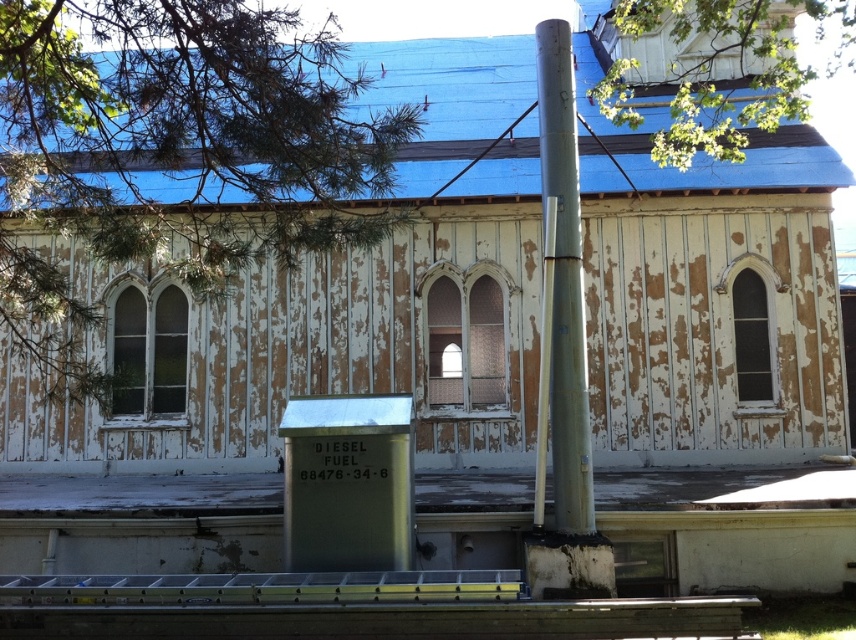
Question: Which of these objects is positioned farthest from the silver metallic pole at center?

Choices:
 (A) green leafy tree at upper left
 (B) green leafy tree at upper center

Answer: (A)

Question: Can you confirm if green leafy tree at upper left is smaller than green leafy tree at upper center?

Choices:
 (A) no
 (B) yes

Answer: (B)

Question: Does green leafy tree at upper center lie in front of silver metallic pole at center?

Choices:
 (A) yes
 (B) no

Answer: (B)

Question: Which object is closer to the camera taking this photo?

Choices:
 (A) silver metallic pole at center
 (B) green leafy tree at upper center

Answer: (A)

Question: Observing the image, what is the correct spatial positioning of green leafy tree at upper left in reference to silver metallic pole at center?

Choices:
 (A) right
 (B) left

Answer: (B)

Question: Among these points, which one is farthest from the camera?

Choices:
 (A) (4, 330)
 (B) (708, 100)

Answer: (A)